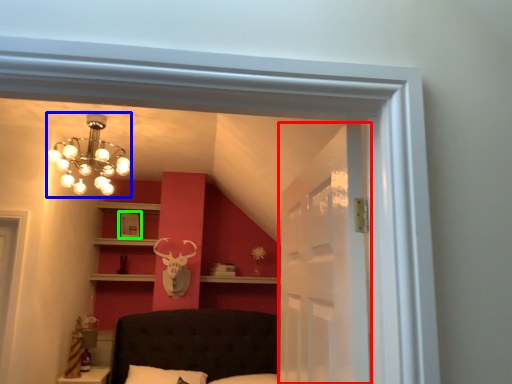
Question: Based on their relative distances, which object is nearer to glass door (highlighted by a red box)? Choose from lamp (highlighted by a blue box) and picture frame (highlighted by a green box).

Choices:
 (A) lamp
 (B) picture frame

Answer: (A)